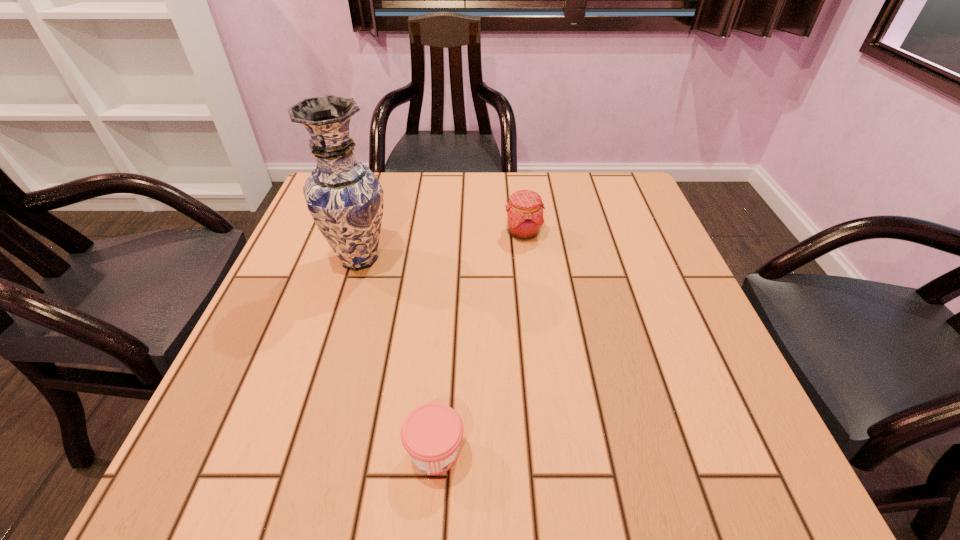
Locate which object is the second closest to the tallest object. Please provide its 2D coordinates. Your answer should be formatted as a tuple, i.e. [(x, y)], where the tuple contains the x and y coordinates of a point satisfying the conditions above.

[(431, 434)]

Image resolution: width=960 pixels, height=540 pixels. Identify the location of free space that satisfies the following two spatial constraints: 1. on the back side of the tallest object; 2. on the right side of the taller jam. (368, 233).

What are the coordinates of `vacant space that satisfies the following two spatial constraints: 1. on the front side of the farther jam; 2. on the front label of the second object from left to right` in the screenshot? It's located at 549,452.